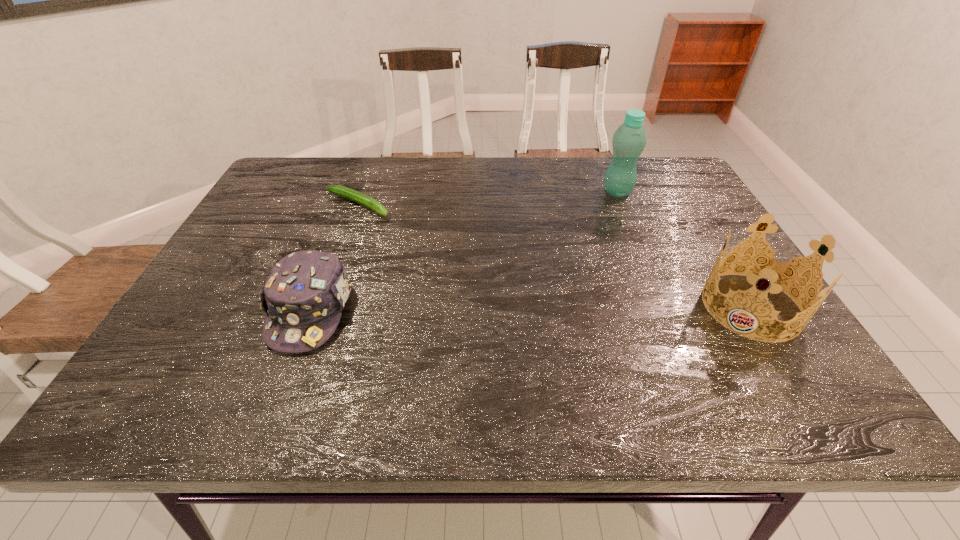
At what (x,y) coordinates should I click in order to perform the action: click on vacant space at the near edge of the desktop. Please return your answer as a coordinate pair (x, y). Looking at the image, I should click on (339, 360).

Find the location of `vacant space at the left edge`. vacant space at the left edge is located at coordinates click(x=212, y=328).

Locate an element on the screen. This screenshot has height=540, width=960. vacant space at the right edge of the desktop is located at coordinates (687, 234).

Find the location of a particular element. Image resolution: width=960 pixels, height=540 pixels. blank space at the far left corner of the desktop is located at coordinates (293, 178).

Image resolution: width=960 pixels, height=540 pixels. I want to click on vacant space at the near right corner, so click(x=759, y=357).

At what (x,y) coordinates should I click in order to perform the action: click on free point between the headwear and the water bottle. Please return your answer as a coordinate pair (x, y). This screenshot has height=540, width=960. Looking at the image, I should click on (464, 251).

This screenshot has width=960, height=540. I want to click on free space between the third tallest object and the crown, so click(x=531, y=308).

Where is `free space between the water bottle and the second shortest object`? This screenshot has width=960, height=540. free space between the water bottle and the second shortest object is located at coordinates (464, 251).

At what (x,y) coordinates should I click in order to perform the action: click on vacant area that lies between the second shortest object and the crown. Please return your answer as a coordinate pair (x, y). The image size is (960, 540). Looking at the image, I should click on (531, 308).

In order to click on vacant region between the third shortest object and the third object from left to right in this screenshot , I will do `click(684, 249)`.